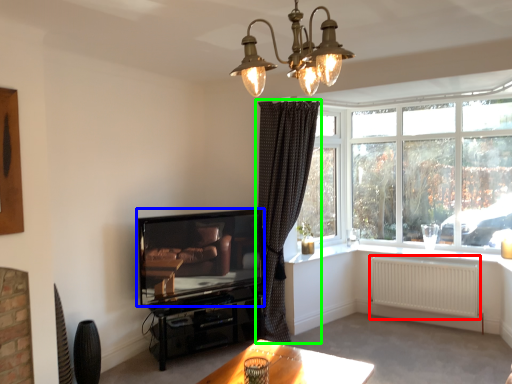
Question: Which object is positioned closest to radiator (highlighted by a red box)? Select from television (highlighted by a blue box) and curtain (highlighted by a green box).

Choices:
 (A) television
 (B) curtain

Answer: (B)